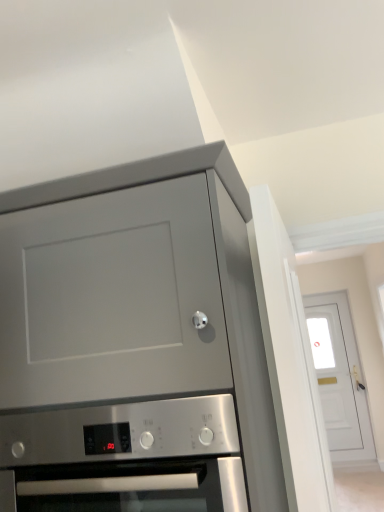
Question: Is matte gray cabinet at upper left bigger or smaller than stainless steel oven at lower center?

Choices:
 (A) big
 (B) small

Answer: (A)

Question: From a real-world perspective, is matte gray cabinet at upper left positioned above or below stainless steel oven at lower center?

Choices:
 (A) below
 (B) above

Answer: (B)

Question: Estimate the real-world distances between objects in this image. Which object is closer to the stainless steel oven at lower center?

Choices:
 (A) white glossy door at upper right
 (B) matte gray cabinet at upper left

Answer: (B)

Question: Based on their relative distances, which object is farther from the white glossy door at upper right?

Choices:
 (A) stainless steel oven at lower center
 (B) matte gray cabinet at upper left

Answer: (A)